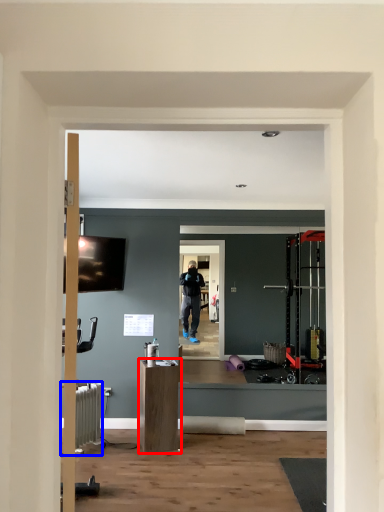
Question: Which point is closer to the camera, furniture (highlighted by a red box) or radiator (highlighted by a blue box)?

Choices:
 (A) furniture
 (B) radiator

Answer: (B)